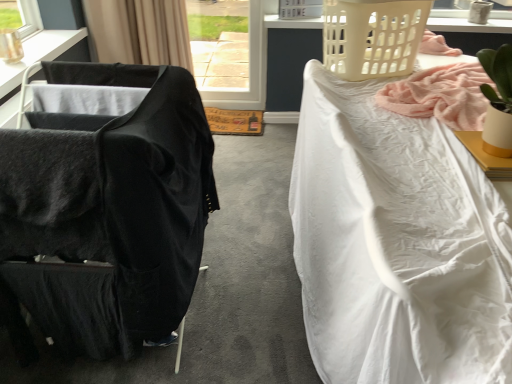
Question: From the image's perspective, would you say black fabric curtain at upper left is shown under white matte desk at upper right?

Choices:
 (A) no
 (B) yes

Answer: (A)

Question: Considering the relative sizes of black fabric curtain at upper left and white matte desk at upper right in the image provided, is black fabric curtain at upper left thinner than white matte desk at upper right?

Choices:
 (A) no
 (B) yes

Answer: (B)

Question: Is black fabric curtain at upper left taller than white matte desk at upper right?

Choices:
 (A) no
 (B) yes

Answer: (B)

Question: Considering the relative sizes of black fabric curtain at upper left and white matte desk at upper right in the image provided, is black fabric curtain at upper left smaller than white matte desk at upper right?

Choices:
 (A) no
 (B) yes

Answer: (A)

Question: Is black fabric curtain at upper left aimed at white matte desk at upper right?

Choices:
 (A) yes
 (B) no

Answer: (B)

Question: From the image's perspective, is black fabric curtain at upper left on top of white matte desk at upper right?

Choices:
 (A) yes
 (B) no

Answer: (A)

Question: Can you confirm if white textured fabric at right is bigger than white matte desk at upper right?

Choices:
 (A) no
 (B) yes

Answer: (B)

Question: Is white textured fabric at right to the right of white matte desk at upper right from the viewer's perspective?

Choices:
 (A) no
 (B) yes

Answer: (B)

Question: Can you confirm if white textured fabric at right is positioned to the left of white matte desk at upper right?

Choices:
 (A) no
 (B) yes

Answer: (A)

Question: Is white textured fabric at right shorter than white matte desk at upper right?

Choices:
 (A) yes
 (B) no

Answer: (B)

Question: Is white textured fabric at right positioned in front of white matte desk at upper right?

Choices:
 (A) no
 (B) yes

Answer: (B)

Question: Is white textured fabric at right surrounding white matte desk at upper right?

Choices:
 (A) no
 (B) yes

Answer: (A)

Question: Does black fabric curtain at upper left have a lesser height compared to black fabric chair at left?

Choices:
 (A) no
 (B) yes

Answer: (B)